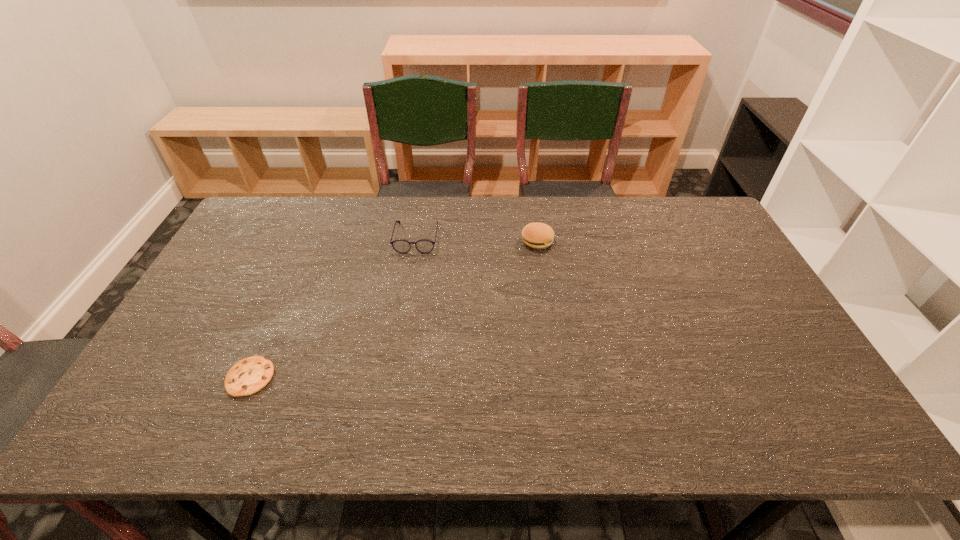
Find the location of a particular element. vacant position in the image that satisfies the following two spatial constraints: 1. on the back side of the nearest object; 2. on the left side of the patty is located at coordinates (310, 241).